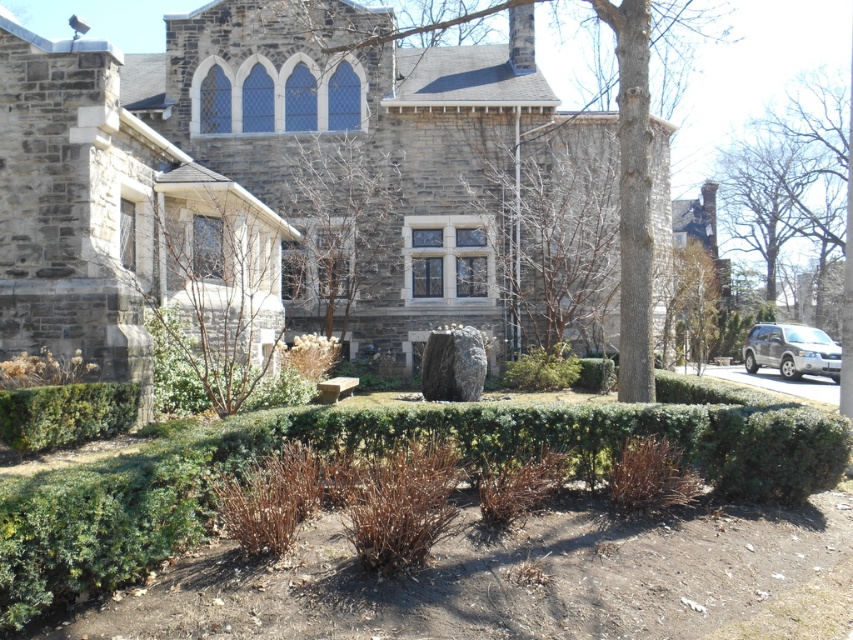
Who is positioned more to the right, bare branches at center or green leafy hedge at lower left?

bare branches at center is more to the right.

Does bare branches at center have a larger size compared to green leafy hedge at lower left?

No, bare branches at center is not bigger than green leafy hedge at lower left.

Who is more distant from viewer, (271, 275) or (28, 448)?

Point (271, 275)

This screenshot has width=853, height=640. I want to click on bare branches at center, so click(213, 285).

Is point (157, 525) positioned before point (430, 35)?

Yes, point (157, 525) is closer to viewer.

Describe the element at coordinates (378, 452) in the screenshot. I see `green leafy hedge at center` at that location.

Does point (195, 538) come in front of point (329, 52)?

Yes.

Where is `green leafy hedge at center`? This screenshot has height=640, width=853. green leafy hedge at center is located at coordinates pyautogui.click(x=378, y=452).

From the picture: Who is more forward, [245,388] or [283,275]?

Point [245,388] is in front.

Is point (247, 358) less distant than point (337, 189)?

Yes, point (247, 358) is closer to viewer.

Where is `bare branches at center`? bare branches at center is located at coordinates (213, 285).